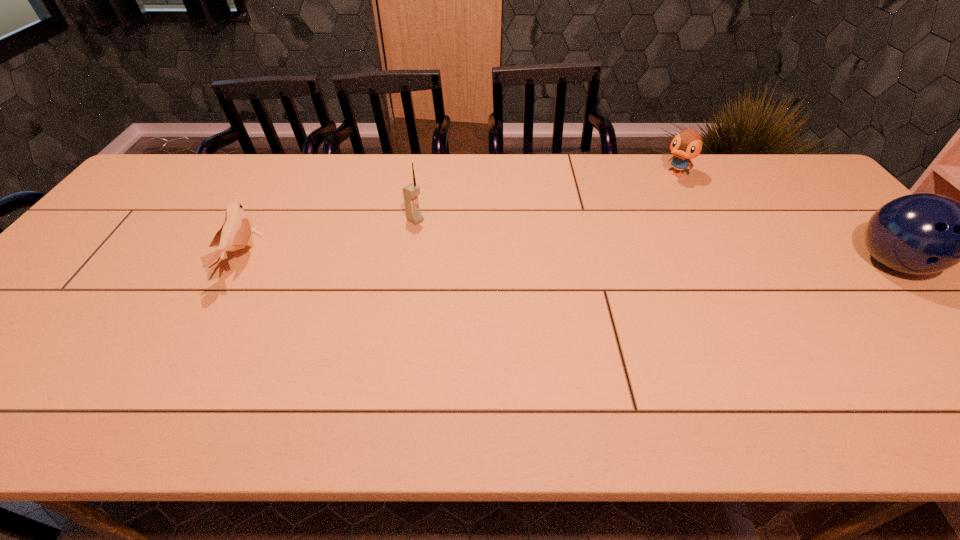
Locate an element on the screen. This screenshot has width=960, height=540. the leftmost object is located at coordinates (234, 234).

This screenshot has height=540, width=960. I want to click on bird, so click(234, 234).

Locate an element on the screen. bowling ball is located at coordinates (924, 233).

Where is `the third object from right to left`? The height and width of the screenshot is (540, 960). the third object from right to left is located at coordinates click(410, 193).

Identify the location of cellular telephone. This screenshot has width=960, height=540. (410, 193).

At what (x,y) coordinates should I click in order to perform the action: click on the third object from left to right. Please return your answer as a coordinate pair (x, y). The width and height of the screenshot is (960, 540). Looking at the image, I should click on (687, 144).

Image resolution: width=960 pixels, height=540 pixels. Identify the location of the second shortest object. (687, 144).

Where is `blank area located at the beak of the leftmost object`? blank area located at the beak of the leftmost object is located at coordinates point(398,259).

Find the location of `vacant space located on the surface of the bowling ball near the finger holes`. vacant space located on the surface of the bowling ball near the finger holes is located at coordinates (938, 314).

You are a GUI agent. You are given a task and a screenshot of the screen. Output one action in this format:
    pyautogui.click(x=<x>, y=<y>)
    Task: Click on the free point located on the front of the cellular telephone, where the keypad is located
    The image size is (960, 540).
    Given the screenshot: What is the action you would take?
    pyautogui.click(x=474, y=255)